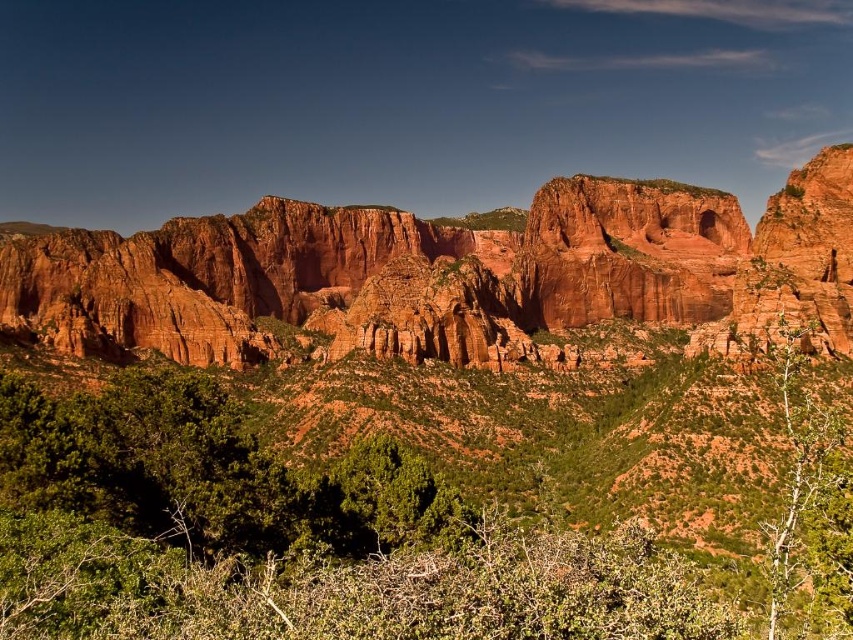
Who is taller, rustic rock formation at center or green leafy tree at right?

rustic rock formation at center is taller.

Is rustic rock formation at center shorter than green leafy tree at right?

Incorrect, rustic rock formation at center's height does not fall short of green leafy tree at right's.

Where is `rustic rock formation at center`? The height and width of the screenshot is (640, 853). rustic rock formation at center is located at coordinates [x=445, y=273].

Who is more distant from viewer, (x=688, y=577) or (x=447, y=548)?

Point (x=688, y=577)

The width and height of the screenshot is (853, 640). I want to click on green leafy shrubs at center, so click(288, 536).

Find the location of `green leafy shrubs at center`. green leafy shrubs at center is located at coordinates (288, 536).

Does rustic rock formation at center have a larger size compared to green leafy tree at center?

Correct, rustic rock formation at center is larger in size than green leafy tree at center.

Is point (567, 314) positioned behind point (412, 520)?

Yes, it is behind point (412, 520).

The width and height of the screenshot is (853, 640). Find the location of `rustic rock formation at center`. rustic rock formation at center is located at coordinates (445, 273).

Where is `rustic rock formation at center`? Image resolution: width=853 pixels, height=640 pixels. rustic rock formation at center is located at coordinates (445, 273).